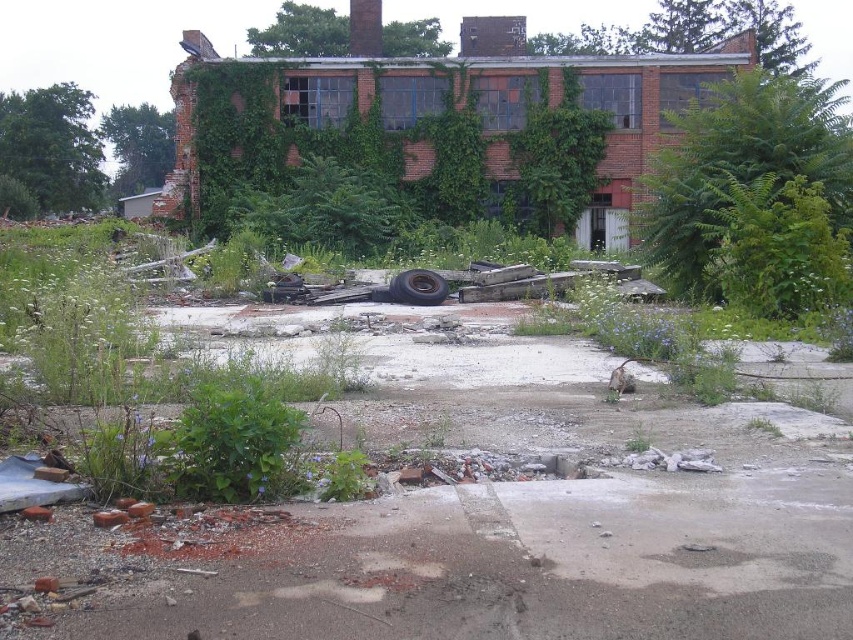
You are a drone operator tasked with capturing aerial footage of the abandoned industrial building. Your drone has a maximum flight range of 15 meters. If you are standing at the camera position, can your drone reach the green leafy plant at upper right?

The green leafy plant at upper right is 15.85 meters away from the camera. Since the drone can only fly up to 15 meters, it cannot reach the plant.

You are standing in front of the abandoned industrial building and want to walk towards the green leafy tree at left. Which direction should you face to ensure you are moving towards it without obstacles from the green leafy plant at upper right?

Since the green leafy plant at upper right is to the right of the green leafy tree at left, you should face towards the left side of the building to move towards the green leafy tree at left while avoiding the green leafy plant at upper right being in your path.

You are standing at the entrance of the abandoned industrial building and want to walk towards the point that is closer to you. Which point should you head towards, point (27,150) or point (395,282)?

You should head towards point (395,282) because it is closer to you than point (27,150), which is further away.